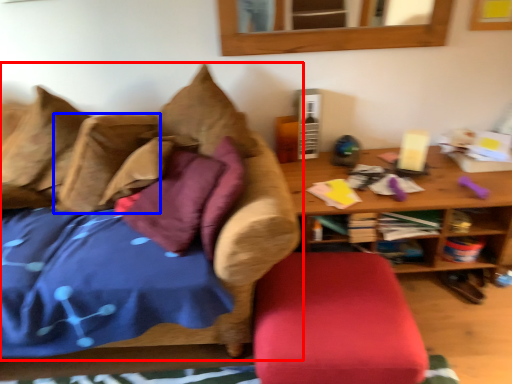
Question: Which point is closer to the camera, studio couch (highlighted by a red box) or pillow (highlighted by a blue box)?

Choices:
 (A) studio couch
 (B) pillow

Answer: (A)